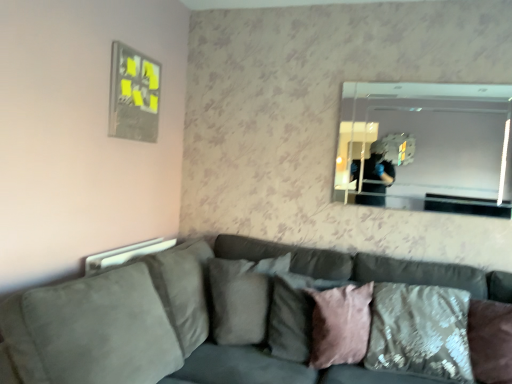
Question: From a real-world perspective, is velvet textured pillow at lower right, the 4th pillow in the left-to-right sequence, positioned above or below suede gray couch at center?

Choices:
 (A) below
 (B) above

Answer: (B)

Question: Relative to suede gray couch at center, is velvet textured pillow at lower right, the 4th pillow in the left-to-right sequence, in front or behind?

Choices:
 (A) behind
 (B) front

Answer: (A)

Question: Which object is the farthest from the clear glass mirror at upper right?

Choices:
 (A) pink velvet pillow at center, placed as the 2th pillow when sorted from right to left
 (B) velvet textured pillow at lower right, the 4th pillow in the left-to-right sequence
 (C) suede-like gray pillow at center, arranged as the 4th pillow when viewed from the right
 (D) pink velvet pillow at center, arranged as the 2th pillow when viewed from the left
 (E) metallic silver picture frame at upper left

Answer: (E)

Question: Which of these objects is positioned closest to the suede gray couch at center?

Choices:
 (A) pink velvet pillow at center, the 3th pillow from the left
 (B) metallic silver picture frame at upper left
 (C) pink velvet pillow at center, arranged as the 3th pillow when viewed from the right
 (D) clear glass mirror at upper right
 (E) suede-like gray pillow at center, arranged as the 1th pillow when viewed from the left

Answer: (E)